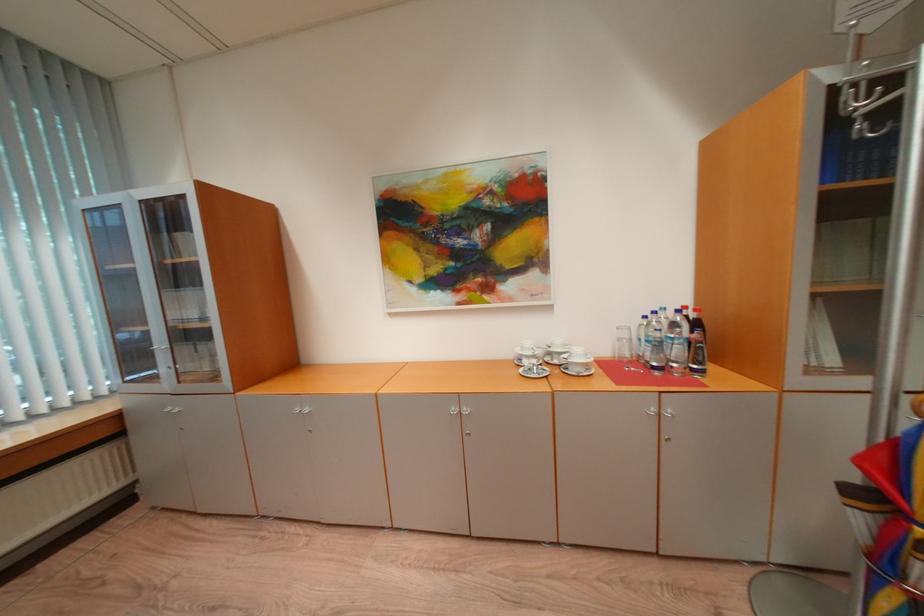
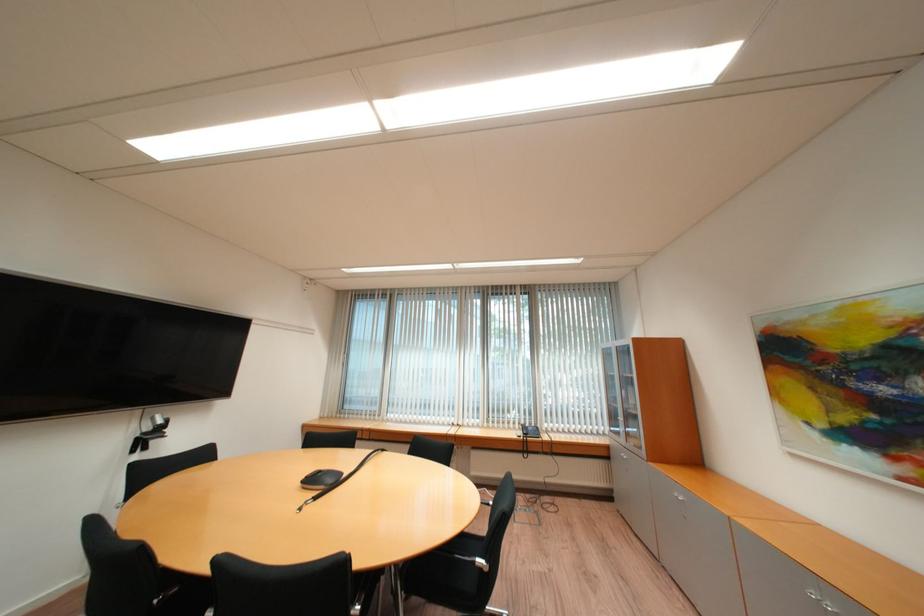
Find the pixel in the second image that matches point 176,386 in the first image.

(630, 440)